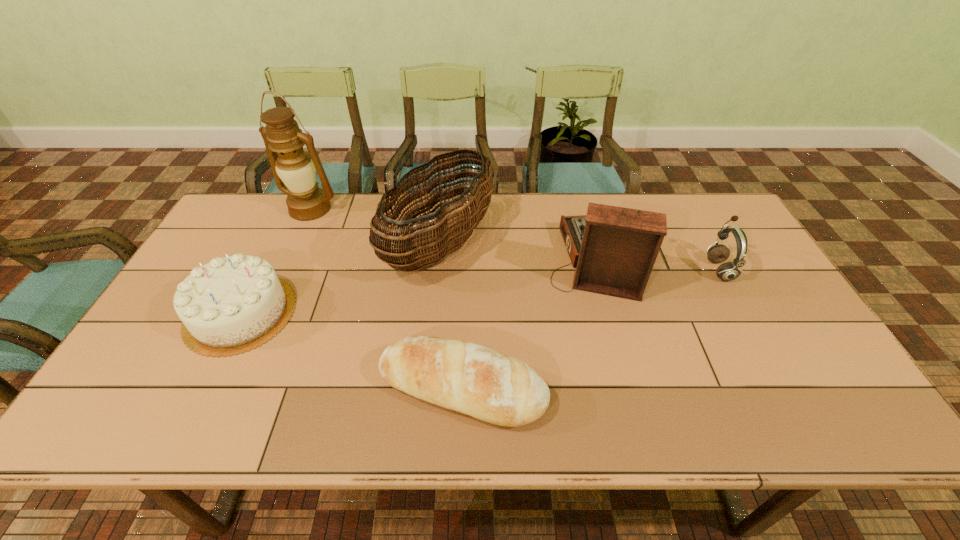
I want to click on object that is positioned at the right edge, so click(728, 271).

You are a GUI agent. You are given a task and a screenshot of the screen. Output one action in this format:
    pyautogui.click(x=<x>, y=<y>)
    Task: Click on the object positioned at the far left corner
    The height and width of the screenshot is (540, 960).
    Given the screenshot: What is the action you would take?
    click(x=295, y=168)

This screenshot has height=540, width=960. In the image, there is a desktop. In order to click on vacant space at the far edge in this screenshot , I will do `click(508, 215)`.

This screenshot has height=540, width=960. In the image, there is a desktop. Find the location of `vacant space at the near edge`. vacant space at the near edge is located at coordinates (370, 427).

Image resolution: width=960 pixels, height=540 pixels. In the image, there is a desktop. What are the coordinates of `free space at the right edge` in the screenshot? It's located at (826, 375).

Identify the location of vacant space at the far right corner of the desktop. The image size is (960, 540). (694, 211).

Locate an element on the screen. The image size is (960, 540). vacant space that's between the rightmost object and the oil lamp is located at coordinates (515, 239).

Locate an element on the screen. This screenshot has height=540, width=960. free space between the phonograph record and the bread is located at coordinates (531, 323).

Locate an element on the screen. Image resolution: width=960 pixels, height=540 pixels. vacant point located between the basket and the fifth object from left to right is located at coordinates (519, 252).

Where is `vacant point located between the bread and the fifth object from left to right`? This screenshot has width=960, height=540. vacant point located between the bread and the fifth object from left to right is located at coordinates (531, 323).